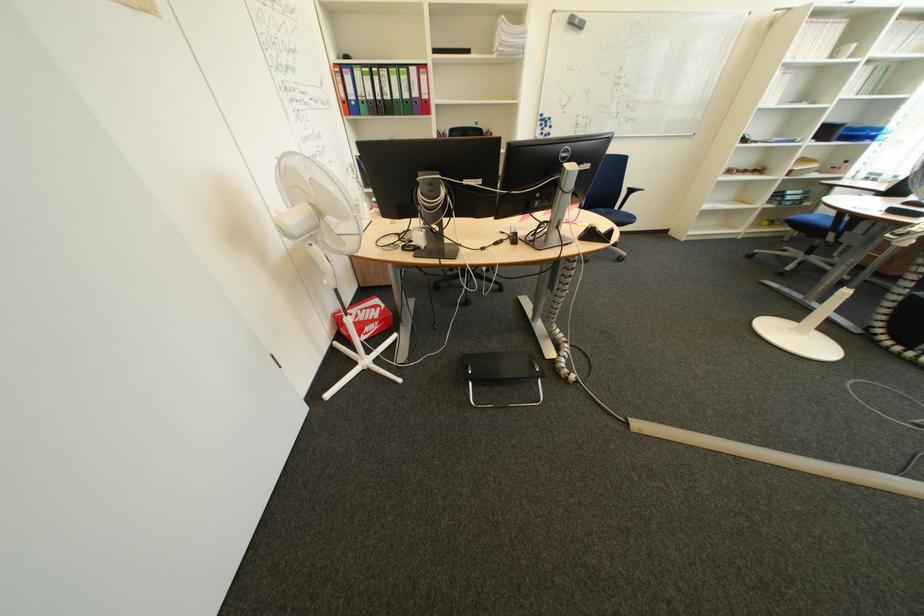
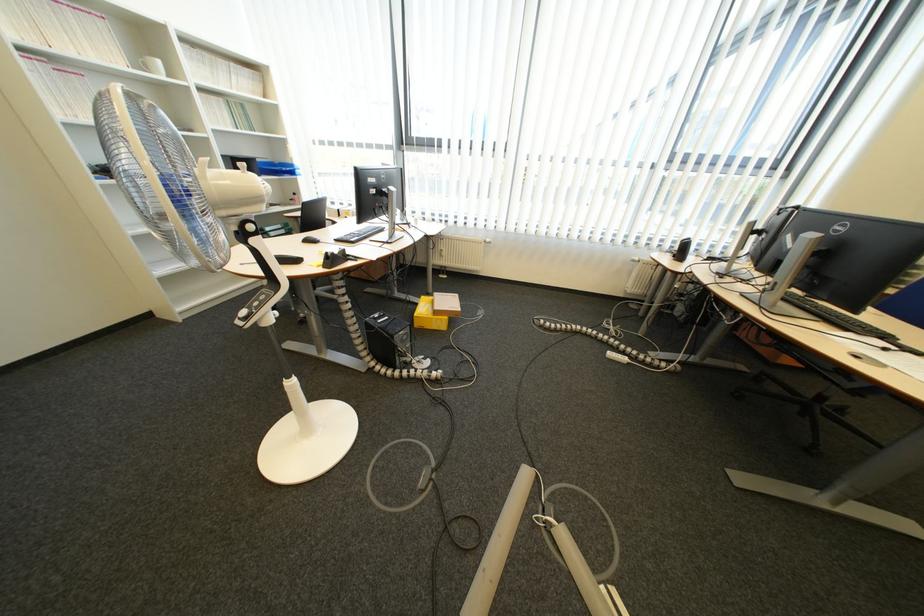
Where in the second image is the point corresponding to pixel 870 128 from the first image?

(289, 163)